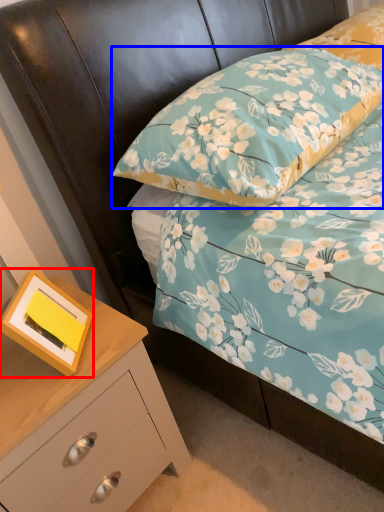
Question: Which object appears closest to the camera in this image, picture frame (highlighted by a red box) or pillow (highlighted by a blue box)?

Choices:
 (A) picture frame
 (B) pillow

Answer: (B)